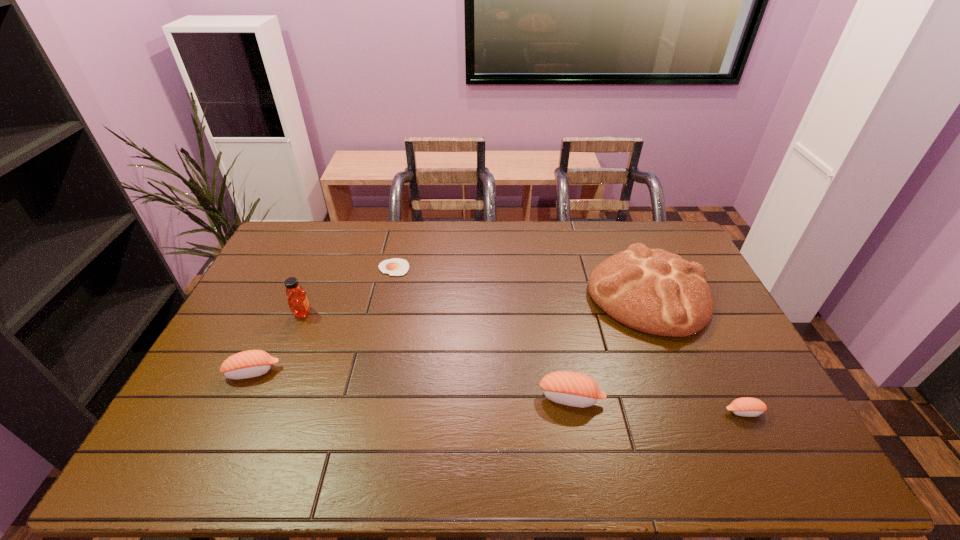
The height and width of the screenshot is (540, 960). I want to click on free space that satisfies the following two spatial constraints: 1. on the front side of the second sushi from right to left; 2. on the left side of the shortest object, so click(x=364, y=398).